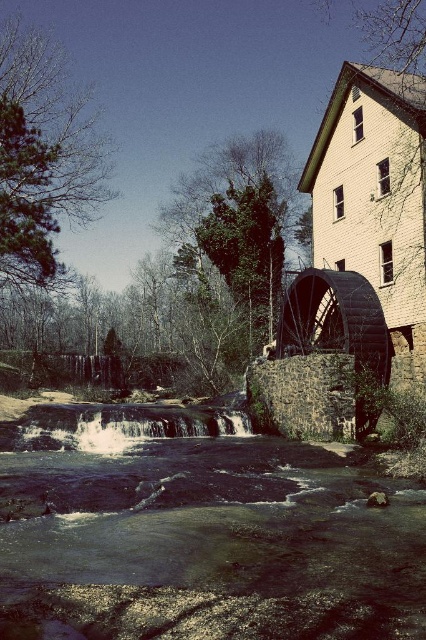
Question: Does dark blue water at center come in front of white frothy water at lower center?

Choices:
 (A) no
 (B) yes

Answer: (B)

Question: Which of the following is the farthest from the observer?

Choices:
 (A) white frothy water at lower center
 (B) dark blue water at center

Answer: (A)

Question: Is dark blue water at center thinner than white frothy water at lower center?

Choices:
 (A) yes
 (B) no

Answer: (B)

Question: Does dark blue water at center lie behind white frothy water at lower center?

Choices:
 (A) yes
 (B) no

Answer: (B)

Question: Which object appears closest to the camera in this image?

Choices:
 (A) dark blue water at center
 (B) white frothy water at lower center

Answer: (A)